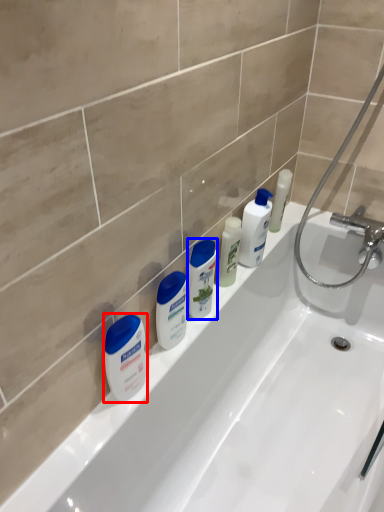
Question: Which point is closer to the camera, cleaning product (highlighted by a red box) or toiletry (highlighted by a blue box)?

Choices:
 (A) cleaning product
 (B) toiletry

Answer: (A)